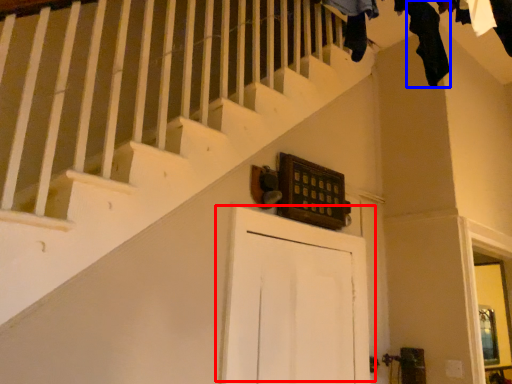
Question: Which object appears farthest to the camera in this image, door (highlighted by a red box) or clothing (highlighted by a blue box)?

Choices:
 (A) door
 (B) clothing

Answer: (B)